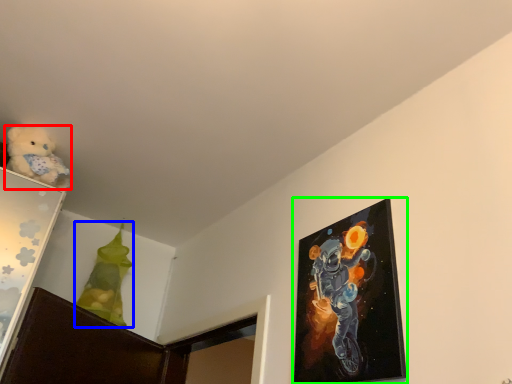
Question: Which object is the closest to the teddy bear (highlighted by a red box)? Choose among these: toy (highlighted by a blue box) or picture frame (highlighted by a green box).

Choices:
 (A) toy
 (B) picture frame

Answer: (A)